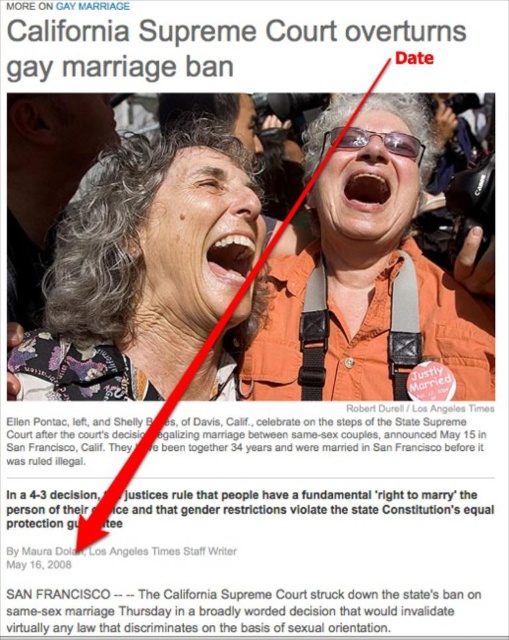
Question: Is orange fabric vest at upper center above matte black goggles at center?

Choices:
 (A) yes
 (B) no

Answer: (B)

Question: Which of these objects is positioned closest to the gray textured hair at upper left?

Choices:
 (A) matte orange shirt at upper right
 (B) matte orange shirt at upper center

Answer: (A)

Question: Which point is farther from the camera taking this photo?

Choices:
 (A) (353, 131)
 (B) (208, 300)
 (C) (418, 147)
 (D) (84, 332)

Answer: (C)

Question: Which of the following is the closest to the observer?

Choices:
 (A) (256, 154)
 (B) (208, 189)
 (C) (366, 140)
 (D) (328, 145)

Answer: (B)

Question: Is matte orange shirt at center smaller than matte orange shirt at upper center?

Choices:
 (A) no
 (B) yes

Answer: (B)

Question: Can you confirm if matte orange shirt at upper right is bigger than matte black goggles at center?

Choices:
 (A) yes
 (B) no

Answer: (B)